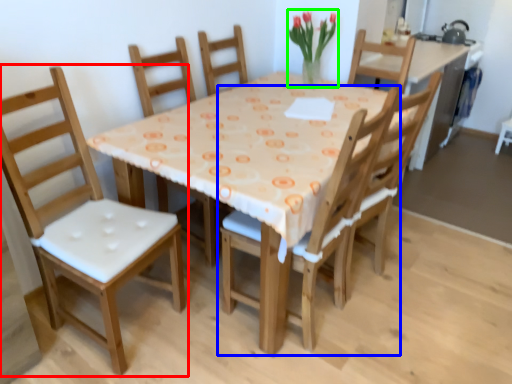
Question: Which object is the closest to the chair (highlighted by a red box)? Choose among these: chair (highlighted by a blue box) or floral arrangement (highlighted by a green box).

Choices:
 (A) chair
 (B) floral arrangement

Answer: (A)